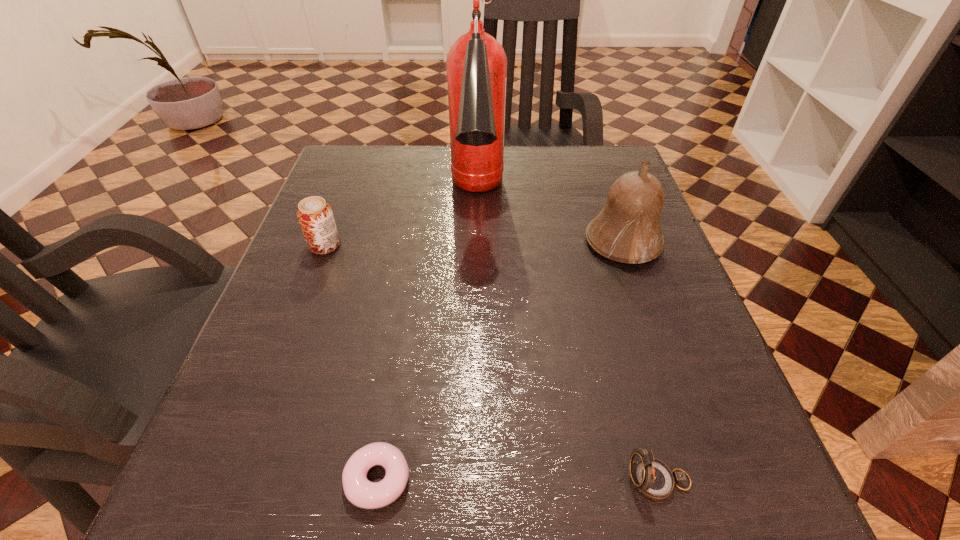
Find the location of `compass situated at the right edge`. compass situated at the right edge is located at coordinates (653, 478).

Locate an element on the screen. This screenshot has height=540, width=960. object at the near right corner is located at coordinates (653, 478).

Image resolution: width=960 pixels, height=540 pixels. I want to click on free space at the far edge, so click(x=509, y=188).

Locate an element on the screen. vacant space at the near edge of the desktop is located at coordinates (616, 517).

I want to click on vacant space at the left edge of the desktop, so click(x=286, y=396).

At what (x,y) coordinates should I click in order to perform the action: click on vacant space at the right edge. Please return your answer as a coordinate pair (x, y). The width and height of the screenshot is (960, 540). Looking at the image, I should click on (619, 310).

In the image, there is a desktop. Where is `free space at the far left corner`? This screenshot has width=960, height=540. free space at the far left corner is located at coordinates (394, 169).

Image resolution: width=960 pixels, height=540 pixels. In the image, there is a desktop. Identify the location of vacant space at the far right corner. (600, 158).

This screenshot has width=960, height=540. I want to click on vacant space at the near right corner of the desktop, so click(738, 495).

Find the location of a particular element. The width and height of the screenshot is (960, 540). empty space that is in between the second shortest object and the tallest object is located at coordinates (568, 340).